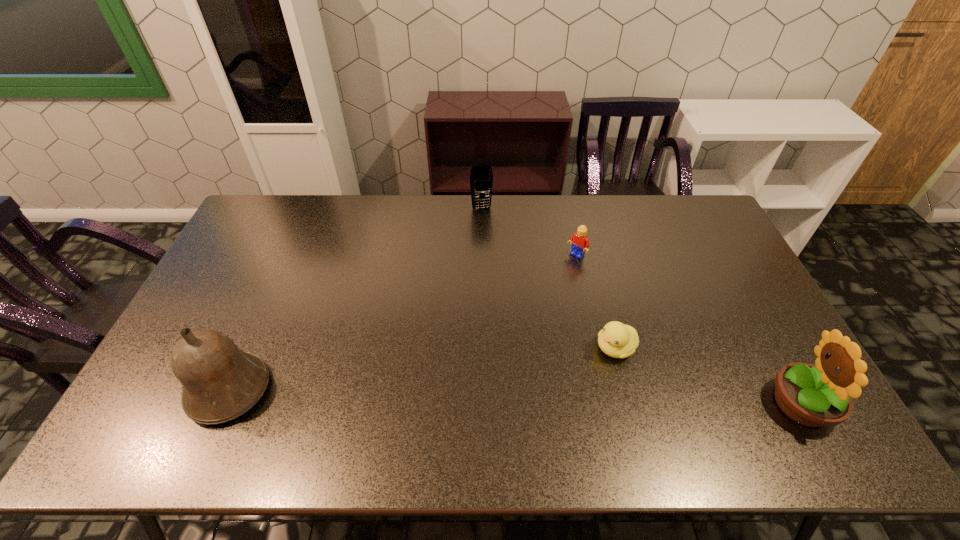
This screenshot has height=540, width=960. In order to click on vacant area at the far left corner in this screenshot , I will do `click(275, 217)`.

You are a GUI agent. You are given a task and a screenshot of the screen. Output one action in this format:
    pyautogui.click(x=<x>, y=<y>)
    Task: Click on the vacant area that lies between the leftmost object and the Lego
    
    Given the screenshot: What is the action you would take?
    pyautogui.click(x=402, y=323)

Where is `empty space between the third tallest object and the rightmost object`? empty space between the third tallest object and the rightmost object is located at coordinates (641, 306).

Find the location of a particular element. The image size is (960, 540). free spot between the farthest object and the sunflower is located at coordinates (641, 306).

This screenshot has width=960, height=540. Find the location of `free space between the farthest object and the Lego`. free space between the farthest object and the Lego is located at coordinates (529, 233).

Where is `blank region between the duckling and the second object from left to right`? This screenshot has width=960, height=540. blank region between the duckling and the second object from left to right is located at coordinates (549, 278).

Where is `free spot between the leftmost object and the rightmost object`? Image resolution: width=960 pixels, height=540 pixels. free spot between the leftmost object and the rightmost object is located at coordinates (515, 397).

Locate an element on the screen. free space between the shortest object and the bell is located at coordinates (422, 369).

You are a GUI agent. You are given a task and a screenshot of the screen. Output one action in this format:
    pyautogui.click(x=<x>, y=<y>)
    Task: Click on the vacant space that is in between the rightmost object and the fourth object from right to left
    
    Given the screenshot: What is the action you would take?
    pyautogui.click(x=641, y=306)

Identify the location of empty space between the Lego and the shortest object. (596, 302).